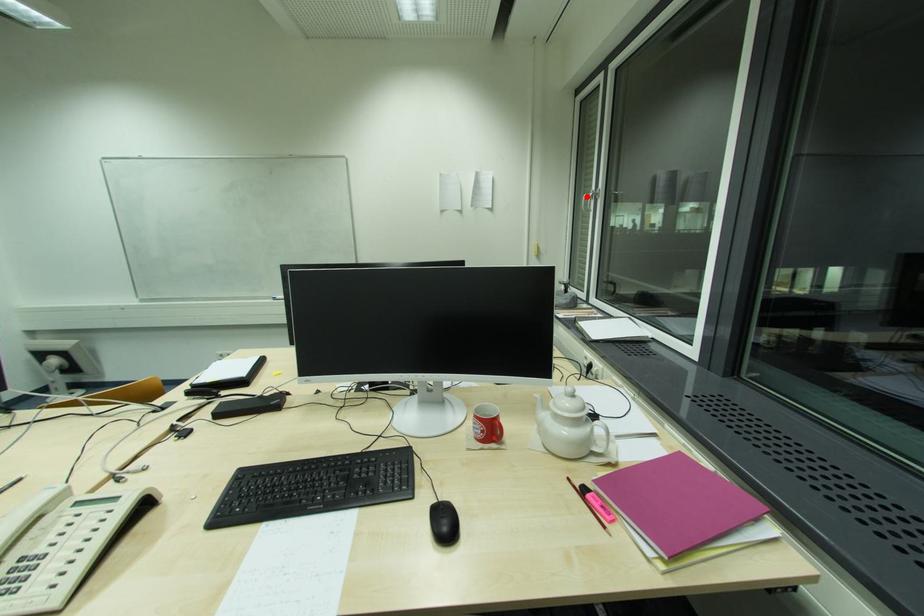
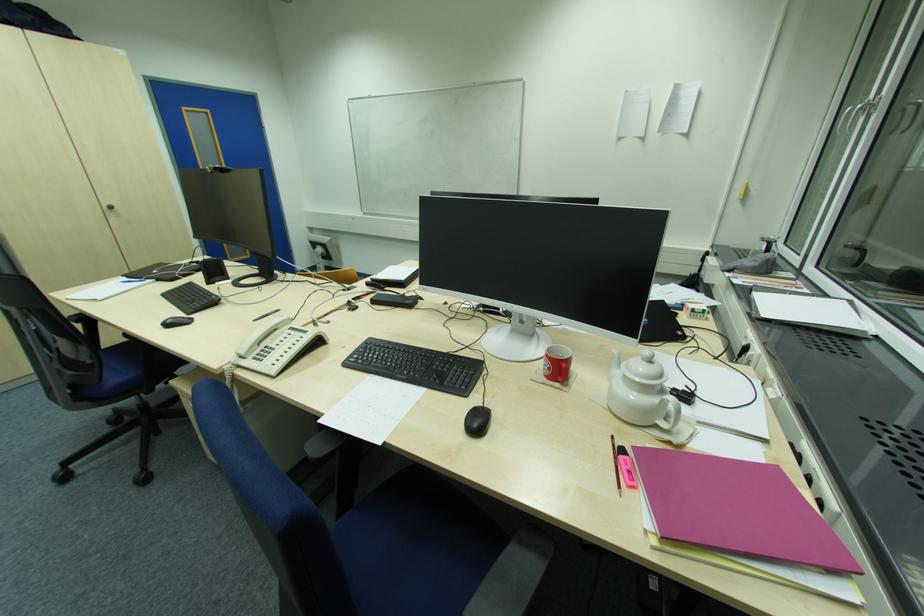
Question: I am providing you with two images of the same scene from different viewpoints. Image1 has a red point marked. In image2, the corresponding 3D location appears at what relative position? Reply with the corresponding letter.

Choices:
 (A) Closer
 (B) Farther

Answer: (B)